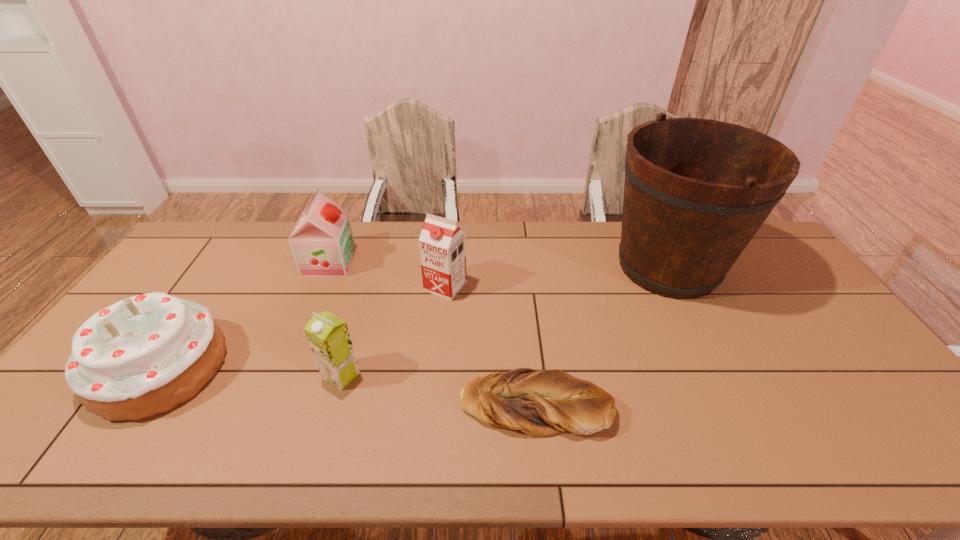
The height and width of the screenshot is (540, 960). I want to click on free spot that satisfies the following two spatial constraints: 1. on the back side of the shortest object; 2. with the cap open on the fifth object from right to left, so click(x=519, y=262).

Find the location of `free space that satisfies the following two spatial constraints: 1. on the back side of the bread; 2. on the right side of the tallest object`. free space that satisfies the following two spatial constraints: 1. on the back side of the bread; 2. on the right side of the tallest object is located at coordinates (520, 267).